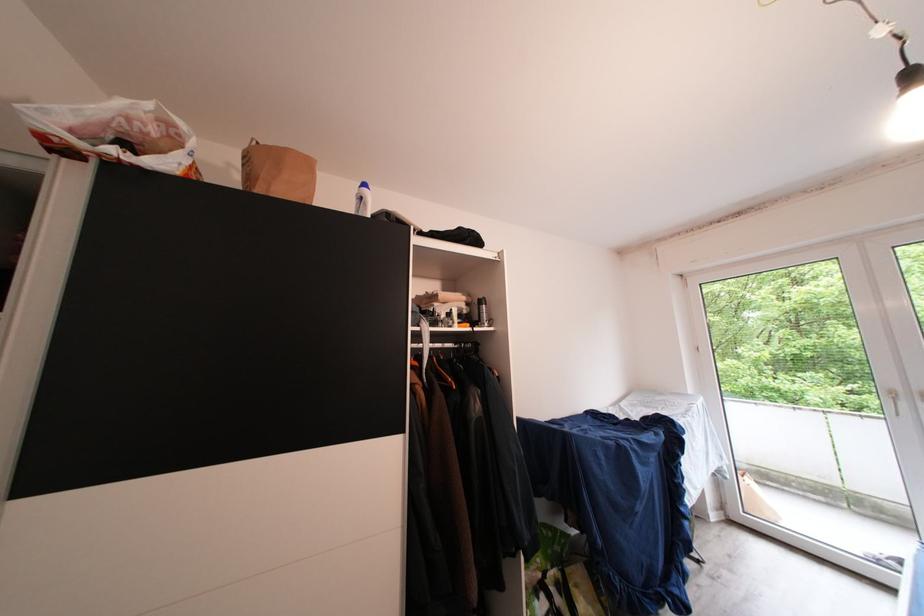
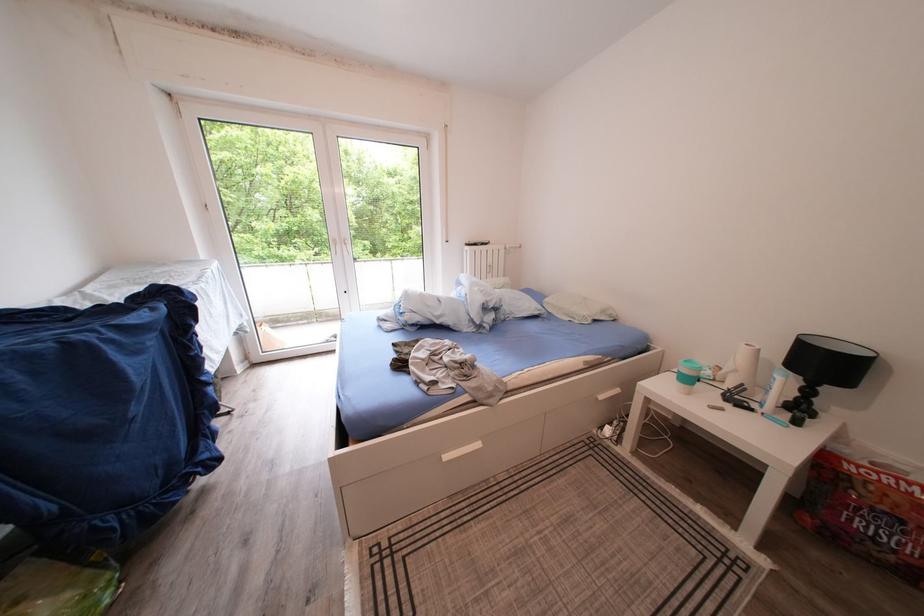
The first image is from the beginning of the video and the second image is from the end. How did the camera likely rotate when shooting the video?

The camera rotated toward right-down.